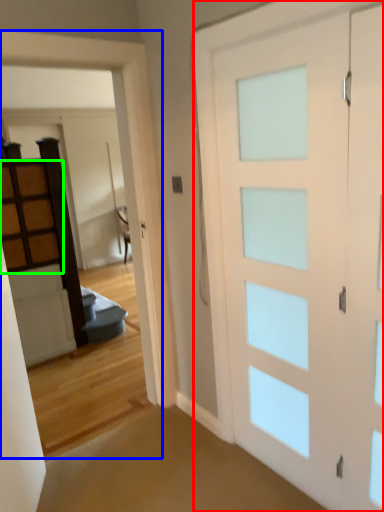
Question: Which object is the farthest from barn door (highlighted by a red box)? Choose among these: garage door (highlighted by a blue box) or cabinetry (highlighted by a green box).

Choices:
 (A) garage door
 (B) cabinetry

Answer: (B)